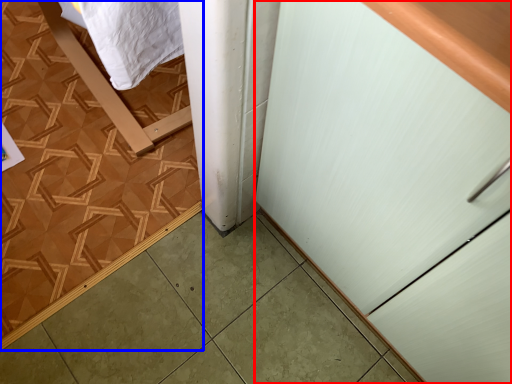
Question: Which object is closer to the camera taking this photo, cabinetry (highlighted by a red box) or ceramic tile (highlighted by a blue box)?

Choices:
 (A) cabinetry
 (B) ceramic tile

Answer: (A)